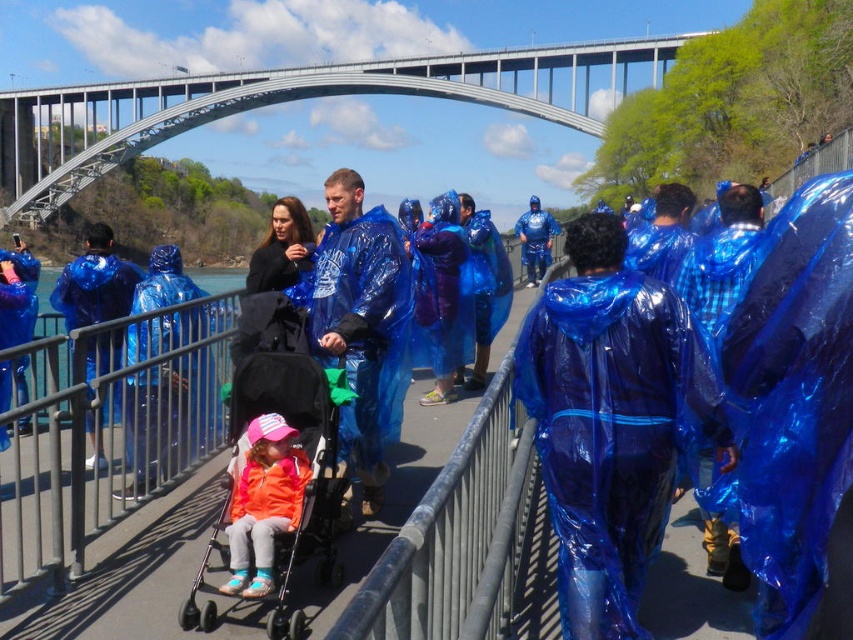
Question: In this image, where is orange fabric stroller at center located relative to metallic gray railing at center?

Choices:
 (A) left
 (B) right

Answer: (A)

Question: Does metallic gray pedestrian bridge at upper center lie behind orange fabric stroller at center?

Choices:
 (A) yes
 (B) no

Answer: (A)

Question: Estimate the real-world distances between objects in this image. Which object is farther from the metallic gray pedestrian bridge at upper center?

Choices:
 (A) metallic gray railing at center
 (B) blue plastic raincoat at center
 (C) orange fleece jacket at center

Answer: (A)

Question: Which object appears closest to the camera in this image?

Choices:
 (A) metallic gray pedestrian bridge at upper center
 (B) metallic gray railing at center
 (C) orange fleece jacket at center

Answer: (B)

Question: Does orange fleece jacket at center have a larger size compared to blue plastic raincoat at center?

Choices:
 (A) no
 (B) yes

Answer: (A)

Question: Among these points, which one is nearest to the camera?

Choices:
 (A) (178, 620)
 (B) (248, 518)
 (C) (512, 100)
 (D) (146, 515)

Answer: (A)